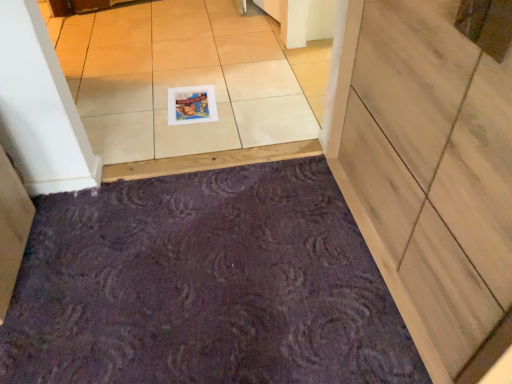
Question: From the image's perspective, is wooden door at lower right located above or below purple textured bath mat at lower center?

Choices:
 (A) below
 (B) above

Answer: (B)

Question: Is wooden door at lower right taller or shorter than purple textured bath mat at lower center?

Choices:
 (A) tall
 (B) short

Answer: (A)

Question: Estimate the real-world distances between objects in this image. Which object is closer to the matte plastic postcard at center?

Choices:
 (A) white glossy tile at upper center
 (B) purple textured bath mat at lower center
 (C) wooden door at lower right

Answer: (A)

Question: Based on their relative distances, which object is farther from the white glossy tile at upper center?

Choices:
 (A) purple textured bath mat at lower center
 (B) matte plastic postcard at center
 (C) wooden door at lower right

Answer: (C)